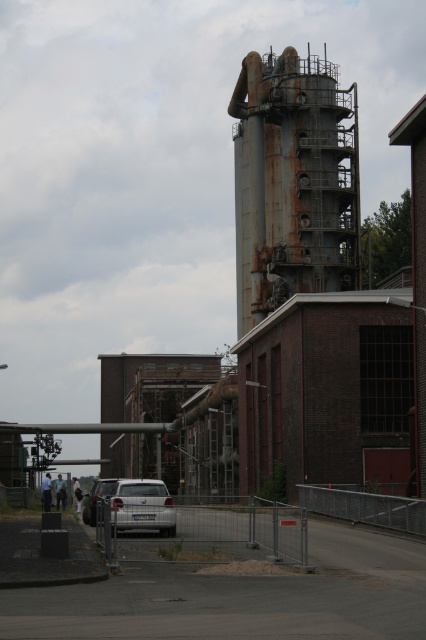
Who is more forward, (164, 484) or (92, 497)?

Point (92, 497) is in front.

Between satin silver car at center and white matte car at lower left, which one appears on the right side from the viewer's perspective?

satin silver car at center is more to the right.

From the picture: Who is more forward, (169,497) or (92,509)?

Point (169,497) is more forward.

Find the location of a particular element. satin silver car at center is located at coordinates (143, 506).

Which is more to the left, rusty metal water tower at center or satin silver car at center?

satin silver car at center

Does rusty metal water tower at center appear on the left side of satin silver car at center?

Incorrect, rusty metal water tower at center is not on the left side of satin silver car at center.

Identify the location of rusty metal water tower at center. (293, 180).

Locate an element on the screen. The height and width of the screenshot is (640, 426). rusty metal water tower at center is located at coordinates (293, 180).

Is rusty metal water tower at center smaller than white matte car at lower left?

Incorrect, rusty metal water tower at center is not smaller in size than white matte car at lower left.

From the picture: Does rusty metal water tower at center appear over white matte car at lower left?

Indeed, rusty metal water tower at center is positioned over white matte car at lower left.

You are a GUI agent. You are given a task and a screenshot of the screen. Output one action in this format:
    pyautogui.click(x=<x>, y=<y>)
    Task: Click on the rusty metal water tower at center
    This screenshot has height=640, width=426.
    Given the screenshot: What is the action you would take?
    pyautogui.click(x=293, y=180)